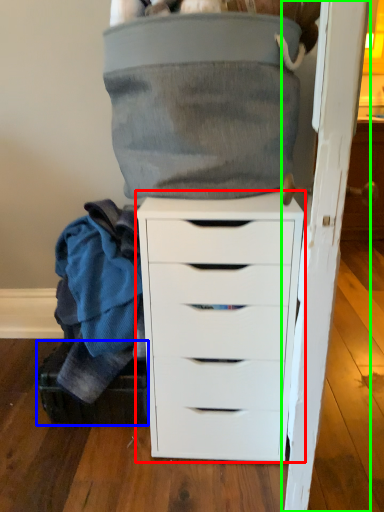
Question: Estimate the real-world distances between objects in this image. Which object is closer to chest of drawers (highlighted by a red box), shoe box (highlighted by a blue box) or door (highlighted by a green box)?

Choices:
 (A) shoe box
 (B) door

Answer: (B)